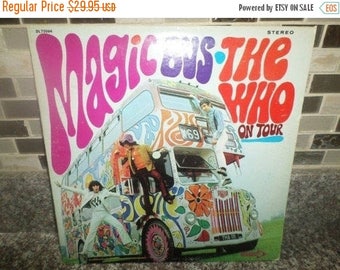
This screenshot has width=340, height=270. Find the location of `window`. window is located at coordinates (144, 110).